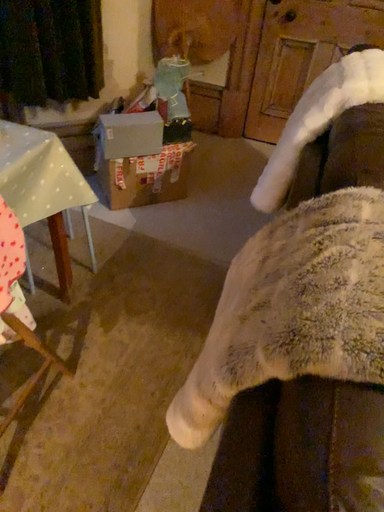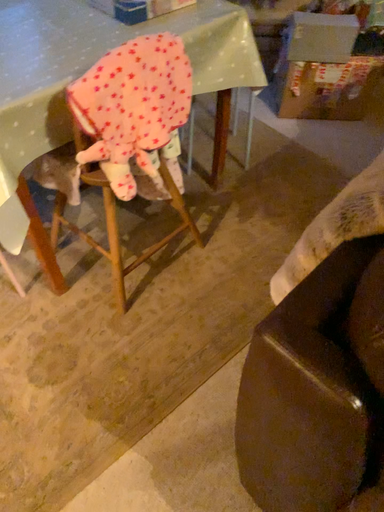
Question: Which way did the camera rotate in the video?

Choices:
 (A) rotated right
 (B) rotated left

Answer: (B)